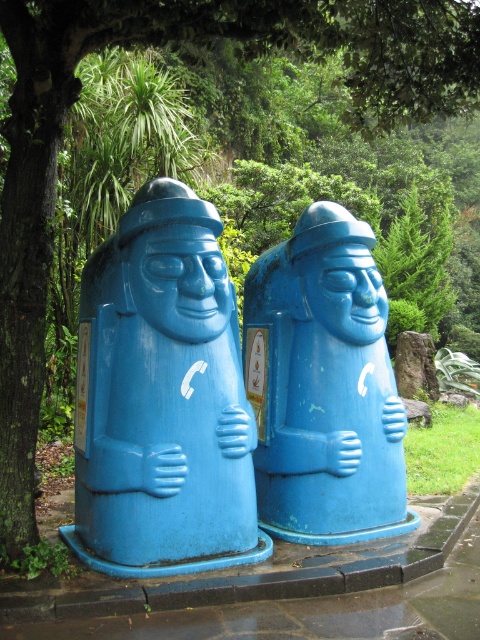
Does blue matte phone booth at center appear on the left side of blue matte sculpture at center?

Indeed, blue matte phone booth at center is positioned on the left side of blue matte sculpture at center.

Between blue matte phone booth at center and blue matte sculpture at center, which one has more height?

With more height is blue matte phone booth at center.

Does point (75, 538) lie behind point (254, 451)?

No.

At what (x,y) coordinates should I click in order to perform the action: click on blue matte phone booth at center. Please return your answer as a coordinate pair (x, y). Looking at the image, I should click on (162, 397).